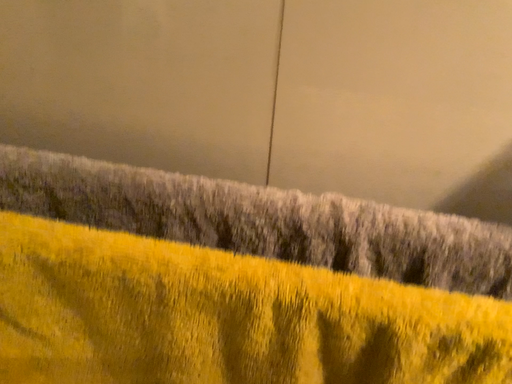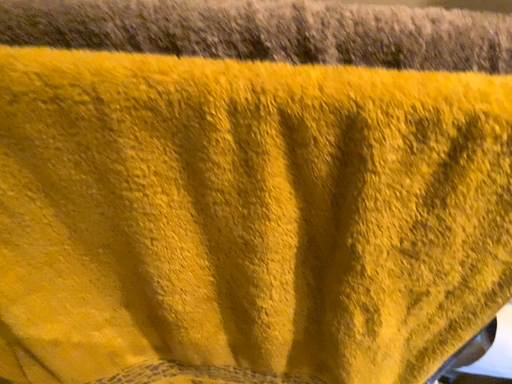
Question: How did the camera likely rotate when shooting the video?

Choices:
 (A) rotated downward
 (B) rotated upward

Answer: (A)